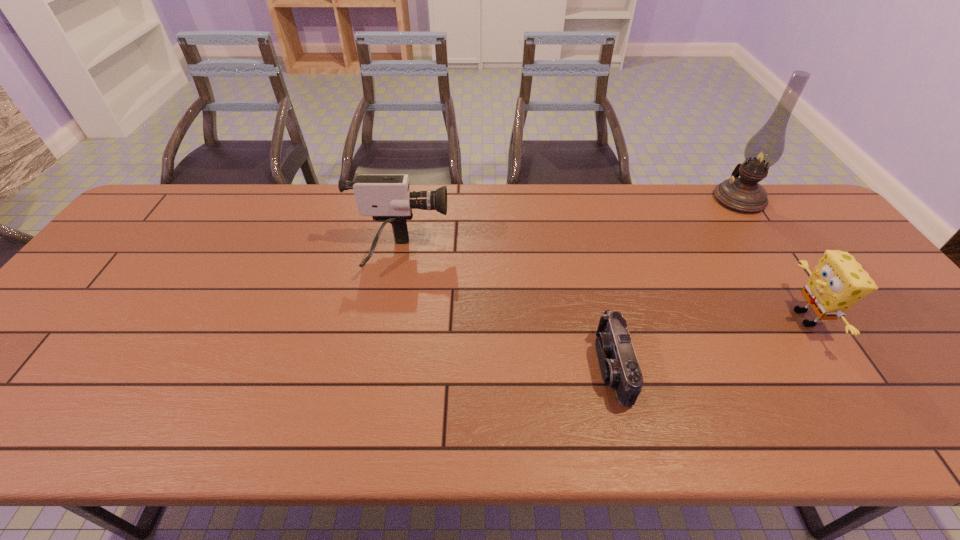
This screenshot has width=960, height=540. I want to click on vacant point located 0.180m on the face of the second shortest object, so click(716, 318).

What are the coordinates of `vacant point located 0.130m on the face of the second shortest object` in the screenshot? It's located at (736, 318).

Where is `vacant space situated 0.380m on the front-facing side of the third object from right to left`? The image size is (960, 540). vacant space situated 0.380m on the front-facing side of the third object from right to left is located at coordinates (428, 367).

The image size is (960, 540). In order to click on vacant area located on the front-facing side of the third object from right to left in this screenshot , I will do `click(539, 367)`.

At what (x,y) coordinates should I click in order to perform the action: click on vacant region located 0.300m on the front-facing side of the third object from right to left. Please return your answer as a coordinate pair (x, y). The image size is (960, 540). Looking at the image, I should click on (464, 367).

The height and width of the screenshot is (540, 960). I want to click on object located at the far edge, so click(743, 194).

At what (x,y) coordinates should I click in order to perform the action: click on object located in the near edge section of the desktop. Please return your answer as a coordinate pair (x, y). This screenshot has height=540, width=960. Looking at the image, I should click on (619, 366).

The width and height of the screenshot is (960, 540). I want to click on object located in the right edge section of the desktop, so click(743, 194).

Locate an element on the screen. object positioned at the far right corner is located at coordinates (743, 194).

Image resolution: width=960 pixels, height=540 pixels. In the image, there is a desktop. Identify the location of vacant region at the far edge. (468, 222).